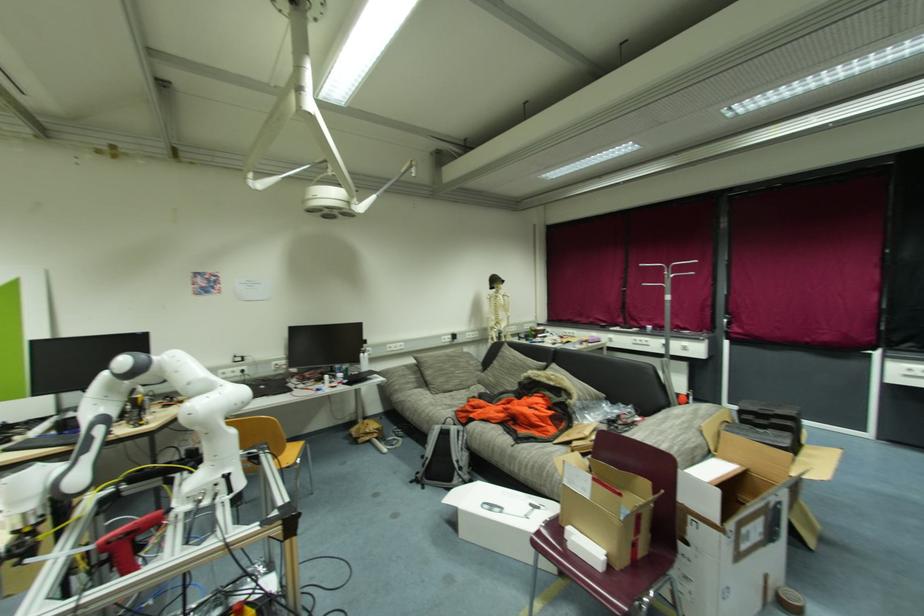
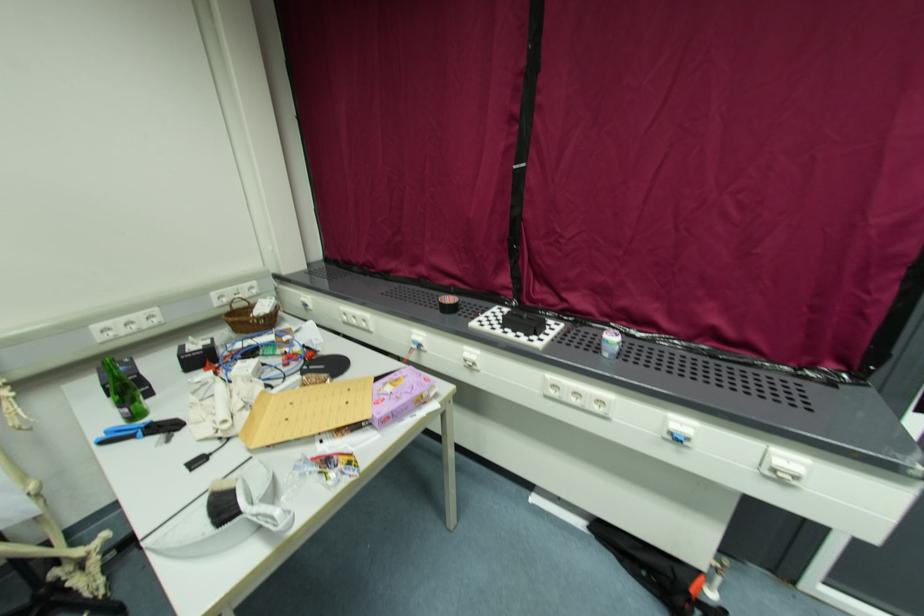
Find the pixel in the second image that matches the point at 614,336 in the first image.

(476, 352)